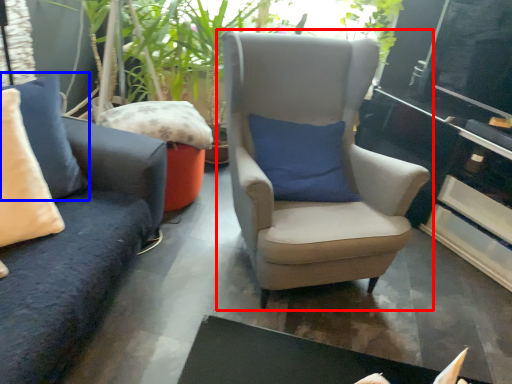
Question: Which of the following is the closest to the observer, chair (highlighted by a red box) or pillow (highlighted by a blue box)?

Choices:
 (A) chair
 (B) pillow

Answer: (B)